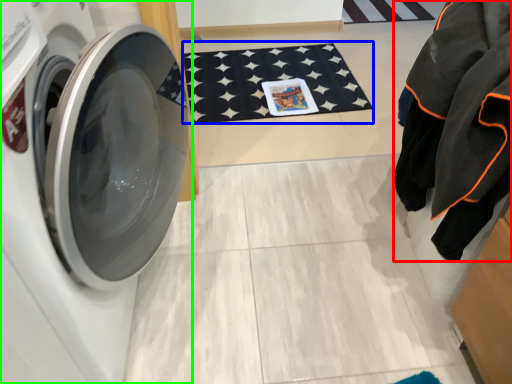
Question: Which is nearer to the clothing (highlighted by a red box)? bath mat (highlighted by a blue box) or washing machine (highlighted by a green box).

Choices:
 (A) bath mat
 (B) washing machine

Answer: (B)